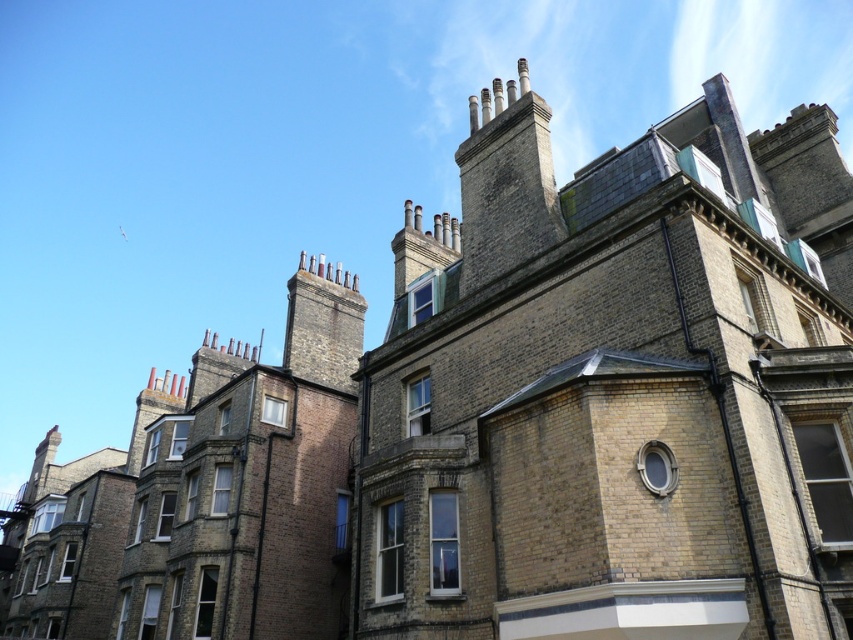
Question: Which object is farther from the camera taking this photo?

Choices:
 (A) brown brick chimney at upper center
 (B) brown stone chimney at upper center

Answer: (B)

Question: Observing the image, what is the correct spatial positioning of brown brick chimney at upper center in reference to brown stone chimney at upper center?

Choices:
 (A) left
 (B) right

Answer: (B)

Question: Does brown brick chimney at upper center appear under brown stone chimney at upper center?

Choices:
 (A) no
 (B) yes

Answer: (A)

Question: Which point is farther to the camera?

Choices:
 (A) brown brick chimney at upper center
 (B) brown stone chimney at upper center

Answer: (B)

Question: Does brown brick chimney at upper center have a lesser width compared to brown stone chimney at upper center?

Choices:
 (A) yes
 (B) no

Answer: (A)

Question: Which of the following is the farthest from the observer?

Choices:
 (A) (352, 310)
 (B) (537, 128)

Answer: (A)